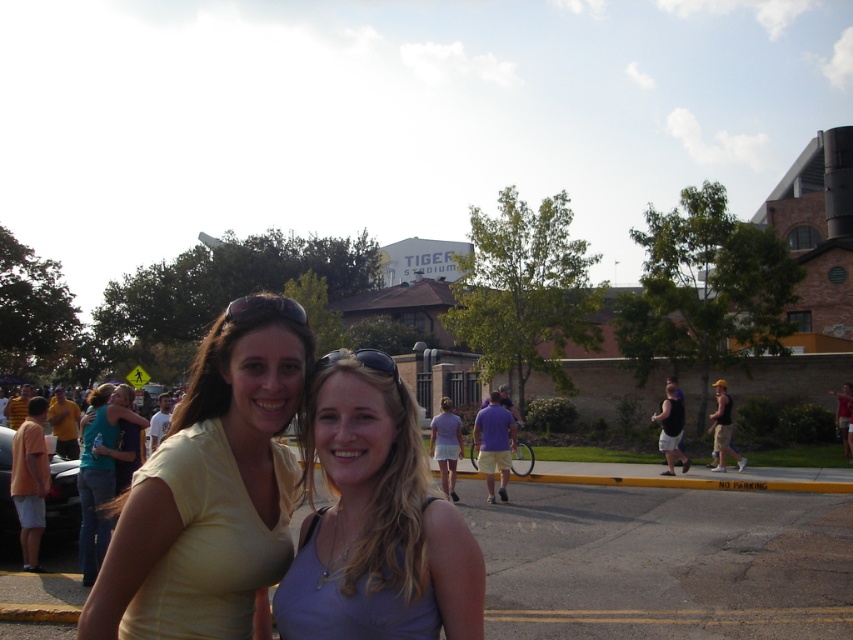
Question: Does yellow matte shirt at center appear under purple matte tank top at center?

Choices:
 (A) no
 (B) yes

Answer: (A)

Question: Is yellow matte shirt at center smaller than purple matte tank top at center?

Choices:
 (A) no
 (B) yes

Answer: (A)

Question: Does yellow matte shirt at center have a larger size compared to purple matte tank top at center?

Choices:
 (A) yes
 (B) no

Answer: (A)